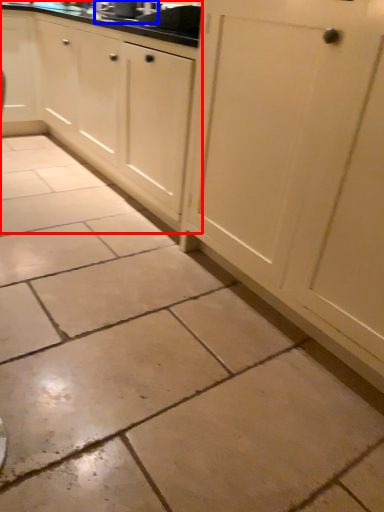
Question: Which object is further to the camera taking this photo, cabinetry (highlighted by a red box) or sink (highlighted by a blue box)?

Choices:
 (A) cabinetry
 (B) sink

Answer: (B)